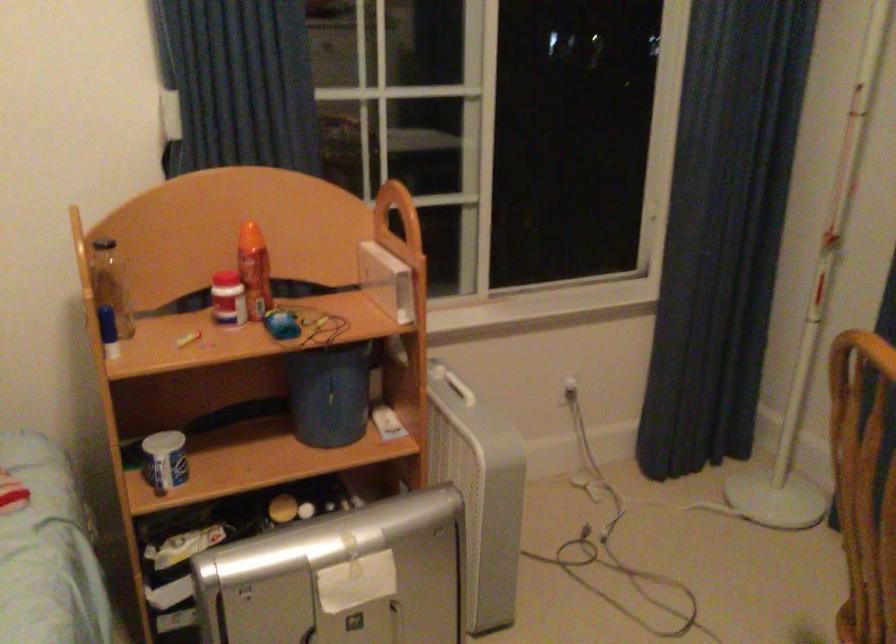
Where would you push the lamp switch? Please return your answer as a coordinate pair (x, y).

(564, 392)